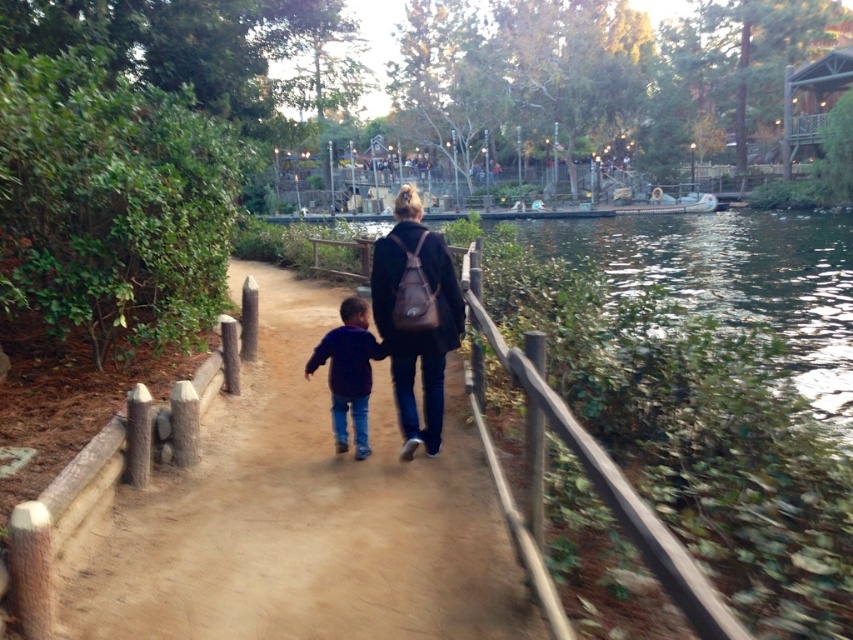
Is greenish water at center smaller than dark blue fleece at center?

No, greenish water at center is not smaller than dark blue fleece at center.

Which is above, greenish water at center or dark blue fleece at center?

Positioned higher is greenish water at center.

Image resolution: width=853 pixels, height=640 pixels. Find the location of `greenish water at center`. greenish water at center is located at coordinates (735, 278).

You are a GUI agent. You are given a task and a screenshot of the screen. Output one action in this format:
    pyautogui.click(x=<x>, y=<y>)
    Task: Click on the greenish water at center
    The image size is (853, 640).
    Given the screenshot: What is the action you would take?
    pyautogui.click(x=735, y=278)

Which of these two, dirt path at center or dark blue fleece at center, stands shorter?

dirt path at center is shorter.

Locate an element on the screen. This screenshot has height=640, width=853. dirt path at center is located at coordinates pyautogui.click(x=303, y=516).

Which is more to the right, dirt path at center or greenish water at center?

From the viewer's perspective, greenish water at center appears more on the right side.

Where is `dirt path at center`? The height and width of the screenshot is (640, 853). dirt path at center is located at coordinates (303, 516).